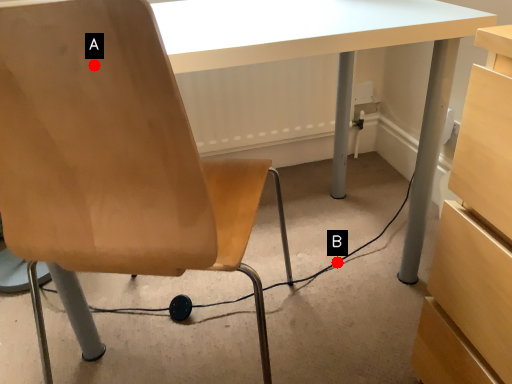
Question: Two points are circled on the image, labeled by A and B beside each circle. Which point appears farthest from the camera in this image?

Choices:
 (A) A is further
 (B) B is further

Answer: (B)